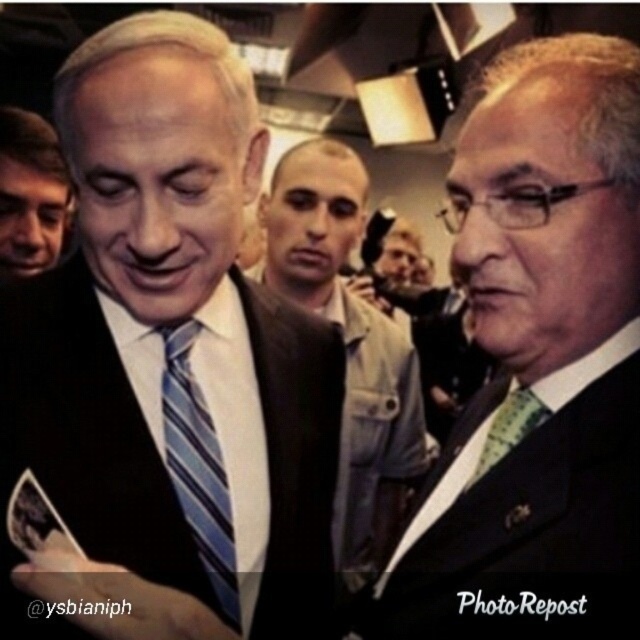
Question: Which object appears closest to the camera in this image?

Choices:
 (A) matte black suit at center
 (B) green textured tie at right

Answer: (A)

Question: Which point is farther to the camera?

Choices:
 (A) matte black suit at center
 (B) matte black suit at right
 (C) matte black suit at left

Answer: (C)

Question: Is matte black suit at center wider than matte black suit at right?

Choices:
 (A) no
 (B) yes

Answer: (B)

Question: Can you confirm if brown leather jacket at center is wider than green textured tie at right?

Choices:
 (A) yes
 (B) no

Answer: (A)

Question: Is brown leather jacket at center thinner than blue striped tie at center?

Choices:
 (A) yes
 (B) no

Answer: (B)

Question: Which of these objects is positioned closest to the matte black suit at left?

Choices:
 (A) matte black suit at center
 (B) brown leather jacket at center

Answer: (B)